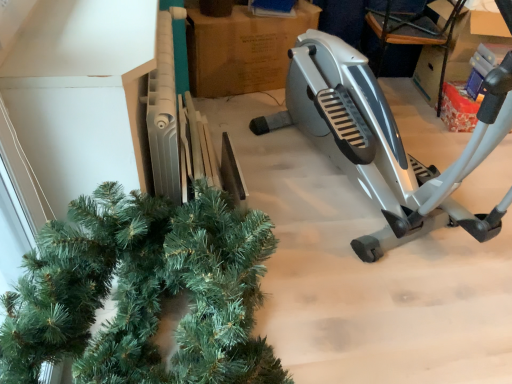
What is the approximate height of silver metallic stationary bicycle at right?

The height of silver metallic stationary bicycle at right is 3.50 feet.

Describe the element at coordinates (383, 142) in the screenshot. This screenshot has width=512, height=384. I see `silver metallic stationary bicycle at right` at that location.

Where is `silver metallic stationary bicycle at right`? silver metallic stationary bicycle at right is located at coordinates (383, 142).

What do you see at coordinates (242, 49) in the screenshot? The height and width of the screenshot is (384, 512). I see `brown cardboard at center` at bounding box center [242, 49].

Image resolution: width=512 pixels, height=384 pixels. What are the coordinates of `brown cardboard at center` in the screenshot? It's located at (242, 49).

This screenshot has width=512, height=384. I want to click on silver metallic stationary bicycle at right, so click(x=383, y=142).

Is silver metallic stationary bicycle at right at the right side of brown cardboard at center?

Yes.

Which object is closer to the camera taking this photo, silver metallic stationary bicycle at right or brown cardboard at center?

silver metallic stationary bicycle at right is closer to the camera.

Is point (342, 111) closer or farther from the camera than point (251, 12)?

Clearly, point (342, 111) is closer to the camera than point (251, 12).

From the image's perspective, which one is positioned higher, silver metallic stationary bicycle at right or brown cardboard at center?

brown cardboard at center appears higher in the image.

From a real-world perspective, is silver metallic stationary bicycle at right physically above brown cardboard at center?

Yes, from a real-world perspective, silver metallic stationary bicycle at right is above brown cardboard at center.

Between silver metallic stationary bicycle at right and brown cardboard at center, which one has smaller width?

Thinner between the two is brown cardboard at center.

Does silver metallic stationary bicycle at right have a greater height compared to brown cardboard at center?

Yes.

Considering the relative sizes of silver metallic stationary bicycle at right and brown cardboard at center in the image provided, is silver metallic stationary bicycle at right smaller than brown cardboard at center?

No.

Is silver metallic stationary bicycle at right inside the boundaries of brown cardboard at center, or outside?

silver metallic stationary bicycle at right is located beyond the bounds of brown cardboard at center.

Is silver metallic stationary bicycle at right not close to brown cardboard at center?

Actually, silver metallic stationary bicycle at right and brown cardboard at center are a little close together.

Is silver metallic stationary bicycle at right facing towards brown cardboard at center?

No, silver metallic stationary bicycle at right is not aimed at brown cardboard at center.

Where is `stationary bicycle that is in front of the brown cardboard at center`? The image size is (512, 384). stationary bicycle that is in front of the brown cardboard at center is located at coordinates (383, 142).

Which object is positioned more to the left, brown cardboard at center or silver metallic stationary bicycle at right?

From the viewer's perspective, brown cardboard at center appears more on the left side.

Is the depth of brown cardboard at center less than that of silver metallic stationary bicycle at right?

No, it is not.

Between point (311, 21) and point (311, 83), which one is positioned in front?

The point (311, 83) is in front.

In the scene shown: From the image's perspective, who appears lower, brown cardboard at center or silver metallic stationary bicycle at right?

silver metallic stationary bicycle at right appears lower in the image.

From the picture: From a real-world perspective, is brown cardboard at center positioned over silver metallic stationary bicycle at right based on gravity?

Incorrect, from a real-world perspective, brown cardboard at center is lower than silver metallic stationary bicycle at right.

Looking at this image, looking at their sizes, would you say brown cardboard at center is wider or thinner than silver metallic stationary bicycle at right?

Considering their sizes, brown cardboard at center looks slimmer than silver metallic stationary bicycle at right.

Is brown cardboard at center taller or shorter than silver metallic stationary bicycle at right?

Clearly, brown cardboard at center is shorter compared to silver metallic stationary bicycle at right.

Consider the image. Considering the sizes of objects brown cardboard at center and silver metallic stationary bicycle at right in the image provided, who is bigger, brown cardboard at center or silver metallic stationary bicycle at right?

With larger size is silver metallic stationary bicycle at right.

Is brown cardboard at center not within silver metallic stationary bicycle at right?

That's correct, brown cardboard at center is outside of silver metallic stationary bicycle at right.

Are brown cardboard at center and silver metallic stationary bicycle at right beside each other?

No, brown cardboard at center is not with silver metallic stationary bicycle at right.

Is brown cardboard at center aimed at silver metallic stationary bicycle at right?

Yes.

Looking at this image, what's the angular difference between brown cardboard at center and silver metallic stationary bicycle at right's facing directions?

brown cardboard at center and silver metallic stationary bicycle at right are facing 5.61 degrees away from each other.

The image size is (512, 384). In order to click on stationary bicycle that is below the brown cardboard at center (from the image's perspective) in this screenshot , I will do `click(383, 142)`.

Find the location of a particular element. The image size is (512, 384). stationary bicycle located above the brown cardboard at center (from a real-world perspective) is located at coordinates (383, 142).

Where is `cardboard box below the silver metallic stationary bicycle at right (from a real-world perspective)`? The image size is (512, 384). cardboard box below the silver metallic stationary bicycle at right (from a real-world perspective) is located at coordinates (242, 49).